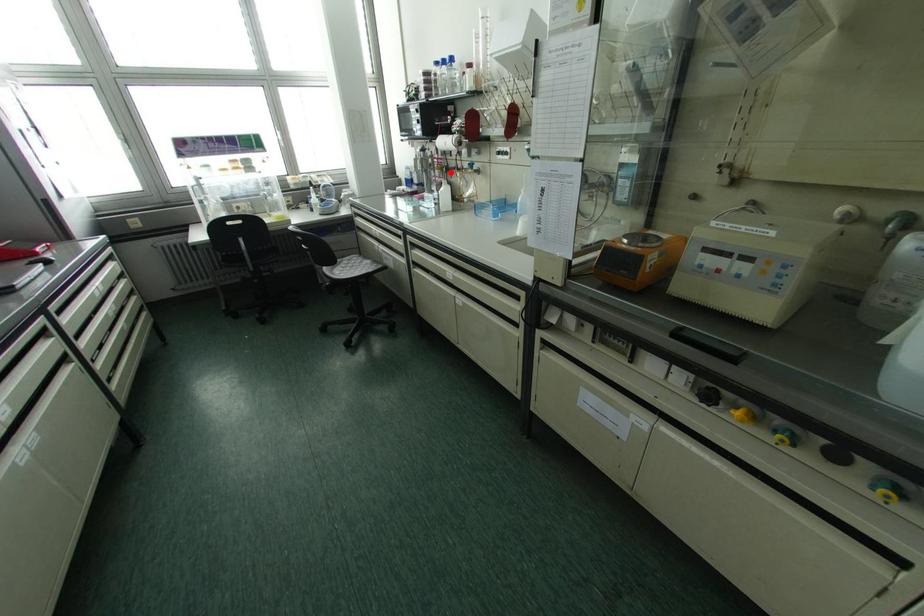
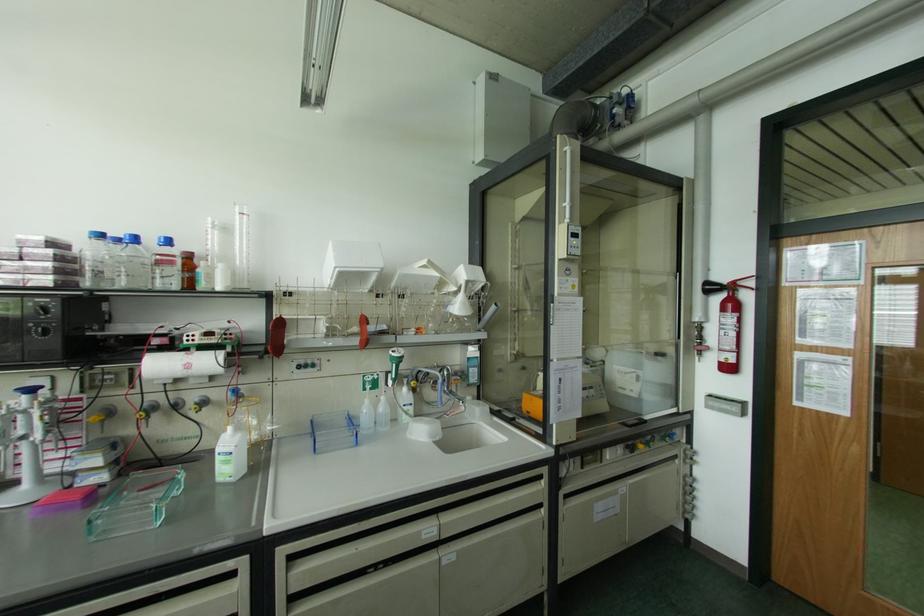
Question: I am providing you with two images of the same scene from different viewpoints. A red point is marked on the first image. At the location where the point appears in image 1, is it still visible in image 2?

Choices:
 (A) Yes
 (B) No

Answer: (A)